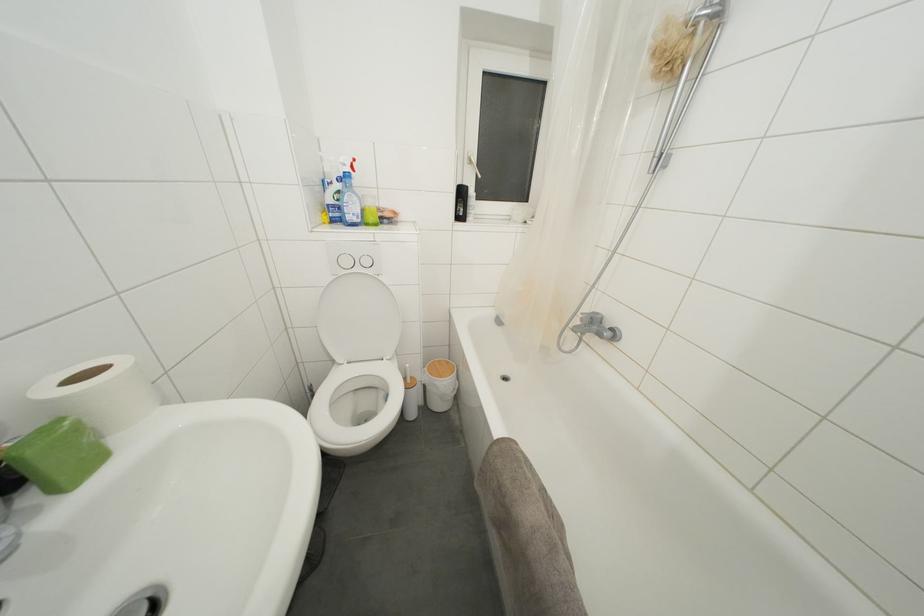
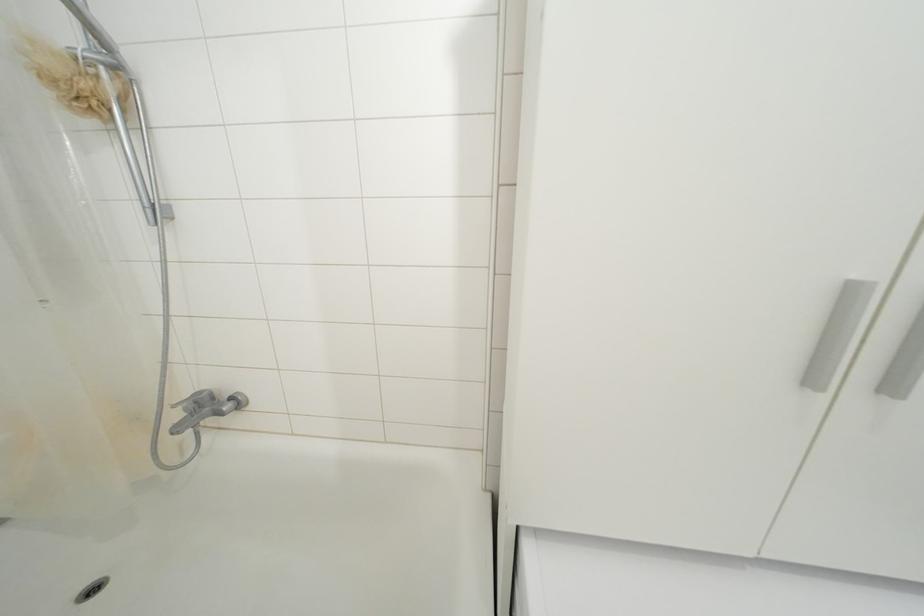
Question: The camera is either moving clockwise (left) or counter-clockwise (right) around the object. The first image is from the beginning of the video and the second image is from the end. Is the camera moving left or right when shooting the video?

Choices:
 (A) Left
 (B) Right

Answer: (A)